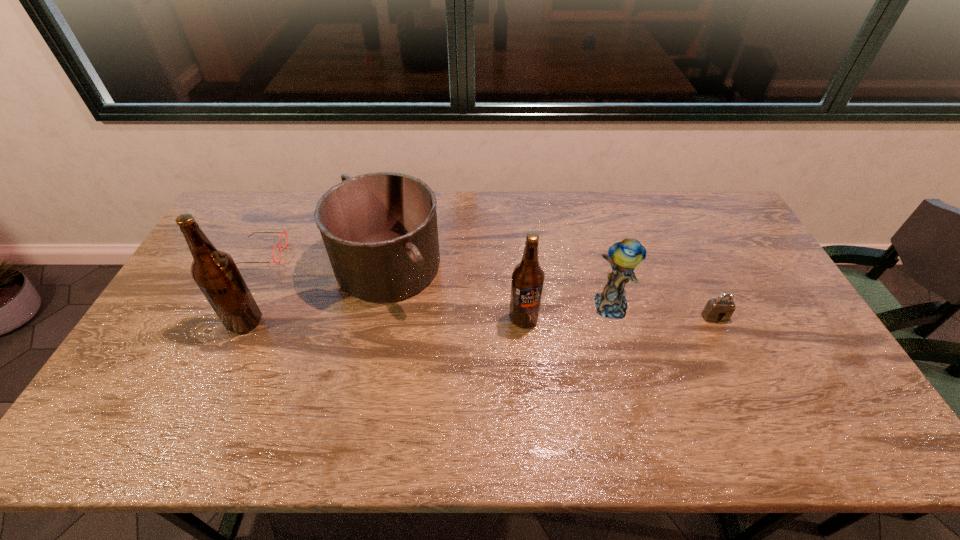
Where is `the taller beer bottle`? Image resolution: width=960 pixels, height=540 pixels. the taller beer bottle is located at coordinates (215, 272).

Where is `the left beer bottle`? Image resolution: width=960 pixels, height=540 pixels. the left beer bottle is located at coordinates (215, 272).

At what (x,y) coordinates should I click in order to perform the action: click on the shorter beer bottle. Please return your answer as a coordinate pair (x, y). The image size is (960, 540). Looking at the image, I should click on (528, 277).

Identify the location of the right beer bottle. (528, 277).

This screenshot has width=960, height=540. In order to click on pan in this screenshot , I will do `click(380, 231)`.

Identify the location of the third shortest object. The image size is (960, 540). (380, 231).

You are a GUI agent. You are given a task and a screenshot of the screen. Output one action in this format:
    pyautogui.click(x=<x>, y=<y>)
    Task: Click on the shortest object
    The height and width of the screenshot is (540, 960).
    Given the screenshot: What is the action you would take?
    pyautogui.click(x=282, y=231)

Where is `the fifth object from left to right`? the fifth object from left to right is located at coordinates (624, 256).

This screenshot has height=540, width=960. In order to click on padlock in this screenshot , I will do `click(721, 308)`.

Identify the location of the rightmost object. (721, 308).